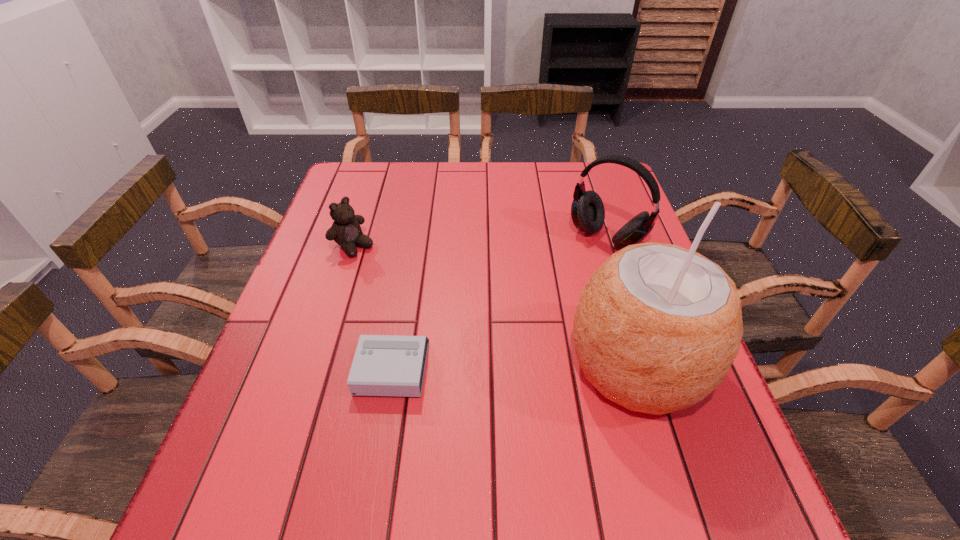
Locate an element on the screen. vacant position located on the ear cups of the headset is located at coordinates (520, 328).

Image resolution: width=960 pixels, height=540 pixels. What are the coordinates of `vacant position located on the face of the teddy bear` in the screenshot? It's located at (473, 333).

The image size is (960, 540). Find the location of `vacant space located 0.350m on the face of the teddy bear`. vacant space located 0.350m on the face of the teddy bear is located at coordinates (464, 326).

Where is `vacant space situated 0.090m on the face of the teddy bear`? vacant space situated 0.090m on the face of the teddy bear is located at coordinates (388, 271).

I want to click on object present at the near edge, so (x=657, y=327).

At what (x,y) coordinates should I click in order to perform the action: click on object at the left edge. Please return your answer as a coordinate pair (x, y). This screenshot has width=960, height=540. Looking at the image, I should click on (346, 231).

You are a GUI agent. You are given a task and a screenshot of the screen. Output one action in this format:
    pyautogui.click(x=<x>, y=<y>)
    Task: Click on the coconut that is positioned at the right edge
    The image size is (960, 540).
    Given the screenshot: What is the action you would take?
    pyautogui.click(x=657, y=327)

You are a GUI agent. You are given a task and a screenshot of the screen. Output one action in this format:
    pyautogui.click(x=<x>, y=<y>)
    Task: Click on the headset present at the right edge
    
    Given the screenshot: What is the action you would take?
    pyautogui.click(x=588, y=214)

Find the location of a particular element. object present at the near right corner is located at coordinates (657, 327).

Locate an element on the screen. The image size is (960, 540). free space at the far edge is located at coordinates (435, 173).